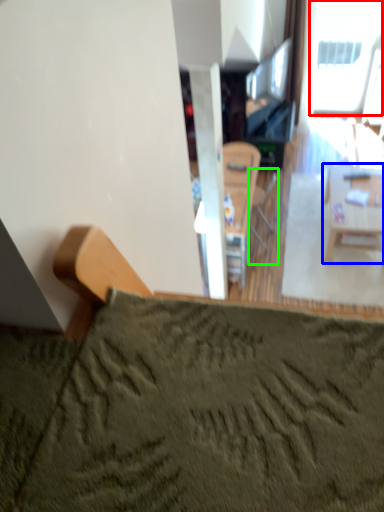
Question: Which object is the farthest from window (highlighted by a red box)? Choose among these: table (highlighted by a blue box) or armchair (highlighted by a green box).

Choices:
 (A) table
 (B) armchair

Answer: (A)